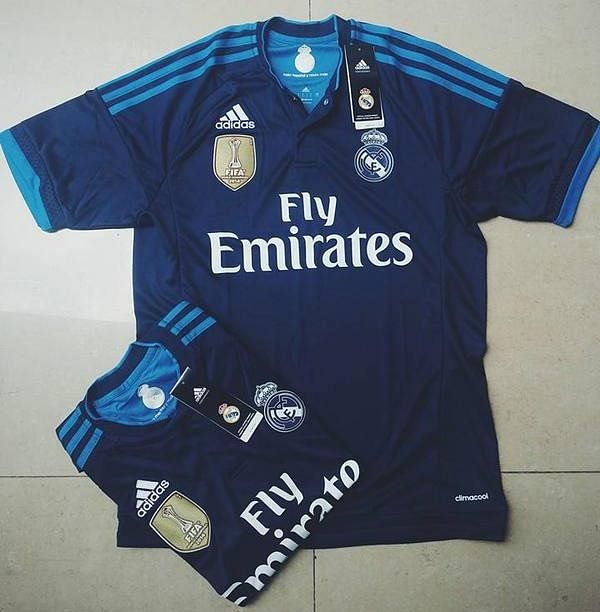
At what (x,y) coordinates should I click in order to perform the action: click on folded up shirt, blue. Please return your answer as a coordinate pair (x, y). Looking at the image, I should click on (221, 483).